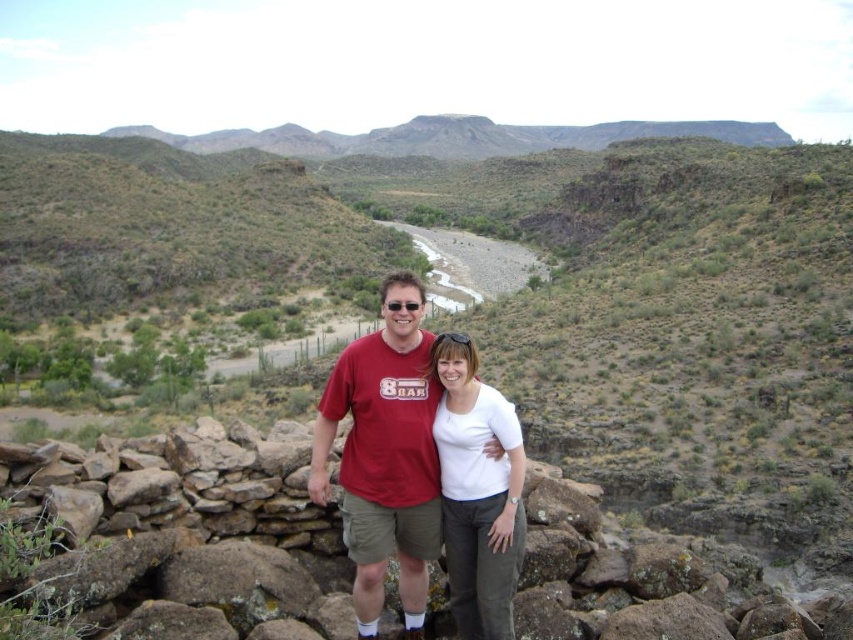
You are a photographer trying to position a tripod in the scene to capture both the white matte shirt at center and the rocky outcrop in the foreground. Given the coordinates provided in the Objects Description, where should you place the tripod to ensure both subjects are in frame?

The white matte shirt at center is located at point (477, 492), so placing the tripod near this coordinate will ensure both the shirt and the rocky outcrop in the foreground are visible in the frame.